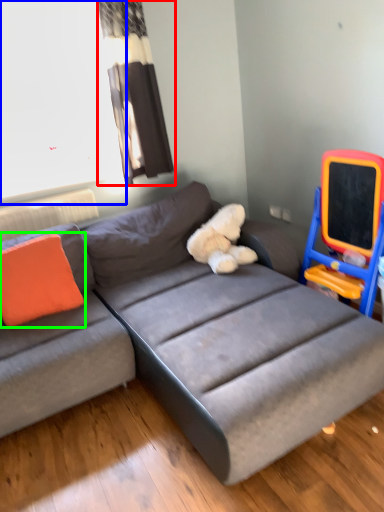
Question: Which is farther away from curtain (highlighted by a red box)? window screen (highlighted by a blue box) or pillow (highlighted by a green box)?

Choices:
 (A) window screen
 (B) pillow

Answer: (B)